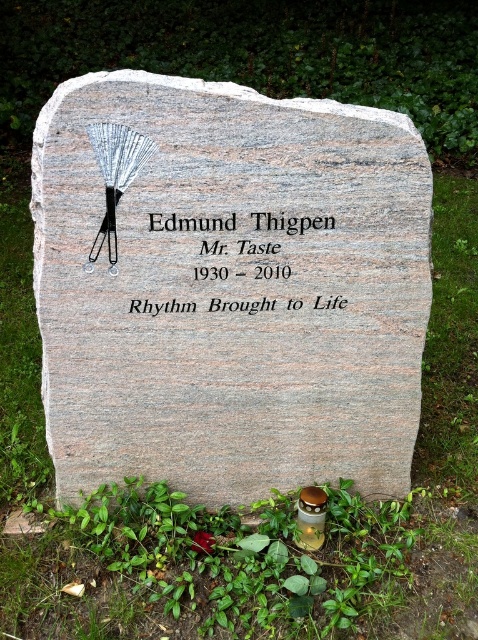
You are standing in front of the tombstone and want to place a bouquet of flowers between the green grass at upper center and the black granite stone at center. Based on their positions, where should you place the flowers?

The green grass at upper center is to the left of the black granite stone at center, so you should place the bouquet between them, positioning it to the right of the green grass at upper center and to the left of the black granite stone at center.

You are a gardener planning to mow the lawn around the black granite stone at center. Considering the green grass at upper center, which area requires more attention for mowing? Please explain based on their sizes.

The green grass at upper center requires more attention for mowing because its width is larger than the black granite stone at center, meaning it covers a broader area that needs maintenance.